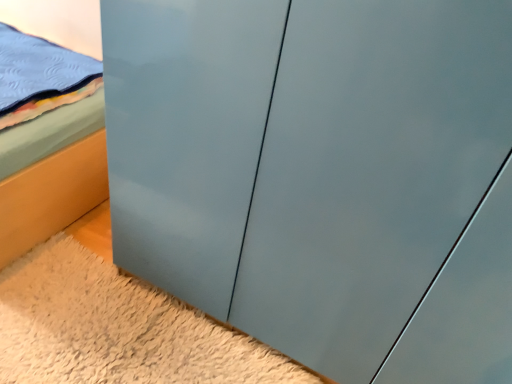
Where is `matte gray cabinet at lower center`? The width and height of the screenshot is (512, 384). matte gray cabinet at lower center is located at coordinates (116, 329).

What is the approximate height of matte gray cabinet at lower center?

The height of matte gray cabinet at lower center is 4.79 centimeters.

What do you see at coordinates (116, 329) in the screenshot?
I see `matte gray cabinet at lower center` at bounding box center [116, 329].

I want to click on matte blue bed at left, so click(51, 196).

This screenshot has width=512, height=384. What do you see at coordinates (51, 196) in the screenshot? I see `matte blue bed at left` at bounding box center [51, 196].

The width and height of the screenshot is (512, 384). In order to click on matte gray cabinet at lower center in this screenshot , I will do `click(116, 329)`.

Which is more to the right, matte gray cabinet at lower center or matte blue bed at left?

Positioned to the right is matte gray cabinet at lower center.

Is the depth of matte gray cabinet at lower center greater than that of matte blue bed at left?

No, it is in front of matte blue bed at left.

Which is closer, (153, 315) or (36, 185)?

The point (153, 315) is in front.

From the image's perspective, is matte gray cabinet at lower center under matte blue bed at left?

Yes.

From a real-world perspective, is matte gray cabinet at lower center on matte blue bed at left?

Actually, matte gray cabinet at lower center is physically below matte blue bed at left in the real world.

Which of these two, matte gray cabinet at lower center or matte blue bed at left, is wider?

matte gray cabinet at lower center is wider.

Considering the sizes of objects matte gray cabinet at lower center and matte blue bed at left in the image provided, who is taller, matte gray cabinet at lower center or matte blue bed at left?

With more height is matte blue bed at left.

Looking at the image, does matte gray cabinet at lower center seem bigger or smaller compared to matte blue bed at left?

matte gray cabinet at lower center is smaller than matte blue bed at left.

Would you say matte gray cabinet at lower center is outside matte blue bed at left?

matte gray cabinet at lower center lies outside matte blue bed at left's area.

Is matte gray cabinet at lower center far away from matte blue bed at left?

No, matte gray cabinet at lower center is in close proximity to matte blue bed at left.

Does matte gray cabinet at lower center turn towards matte blue bed at left?

No, matte gray cabinet at lower center is not aimed at matte blue bed at left.

Can you tell me how much matte gray cabinet at lower center and matte blue bed at left differ in facing direction?

matte gray cabinet at lower center and matte blue bed at left are facing 0.00858 degrees away from each other.

Find the location of a particular element. Image resolution: width=512 pixels, height=384 pixels. bed on the left of matte gray cabinet at lower center is located at coordinates (51, 196).

Between matte blue bed at left and matte gray cabinet at lower center, which one appears on the right side from the viewer's perspective?

From the viewer's perspective, matte gray cabinet at lower center appears more on the right side.

Is matte blue bed at left positioned before matte gray cabinet at lower center?

That is False.

Is point (25, 190) positioned in front of point (231, 351)?

No.

From the image's perspective, does matte blue bed at left appear higher than matte gray cabinet at lower center?

Indeed, from the image's perspective, matte blue bed at left is shown above matte gray cabinet at lower center.

From a real-world perspective, which is physically below, matte blue bed at left or matte gray cabinet at lower center?

matte gray cabinet at lower center, from a real-world perspective.

Considering the sizes of objects matte blue bed at left and matte gray cabinet at lower center in the image provided, who is thinner, matte blue bed at left or matte gray cabinet at lower center?

matte blue bed at left is thinner.

Based on the photo, is matte blue bed at left shorter than matte gray cabinet at lower center?

In fact, matte blue bed at left may be taller than matte gray cabinet at lower center.

Considering the sizes of matte blue bed at left and matte gray cabinet at lower center in the image, is matte blue bed at left bigger or smaller than matte gray cabinet at lower center?

Considering their sizes, matte blue bed at left takes up more space than matte gray cabinet at lower center.

Is matte gray cabinet at lower center located within matte blue bed at left?

Definitely not — matte gray cabinet at lower center is not inside matte blue bed at left.

Is matte blue bed at left far from matte gray cabinet at lower center?

matte blue bed at left is near matte gray cabinet at lower center, not far away.

Is matte blue bed at left looking in the opposite direction of matte gray cabinet at lower center?

That's not correct — matte blue bed at left is not looking away from matte gray cabinet at lower center.

Measure the distance between matte blue bed at left and matte gray cabinet at lower center.

matte blue bed at left is 14.68 inches away from matte gray cabinet at lower center.

The image size is (512, 384). What are the coordinates of `bed located behind the matte gray cabinet at lower center` in the screenshot? It's located at (51, 196).

Locate an element on the screen. This screenshot has height=384, width=512. bed that appears above the matte gray cabinet at lower center (from the image's perspective) is located at coordinates (51, 196).

Find the location of a particular element. This screenshot has height=384, width=512. plain that is below the matte blue bed at left (from the image's perspective) is located at coordinates (116, 329).